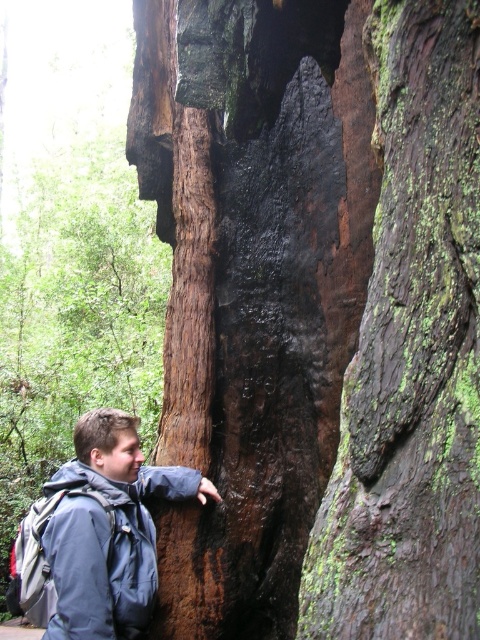
Who is more forward, (393,285) or (75,598)?

Point (393,285) is more forward.

Is green mossy bark at center below blue fabric jacket at left?

Incorrect, green mossy bark at center is not positioned below blue fabric jacket at left.

I want to click on green mossy bark at center, so (410, 355).